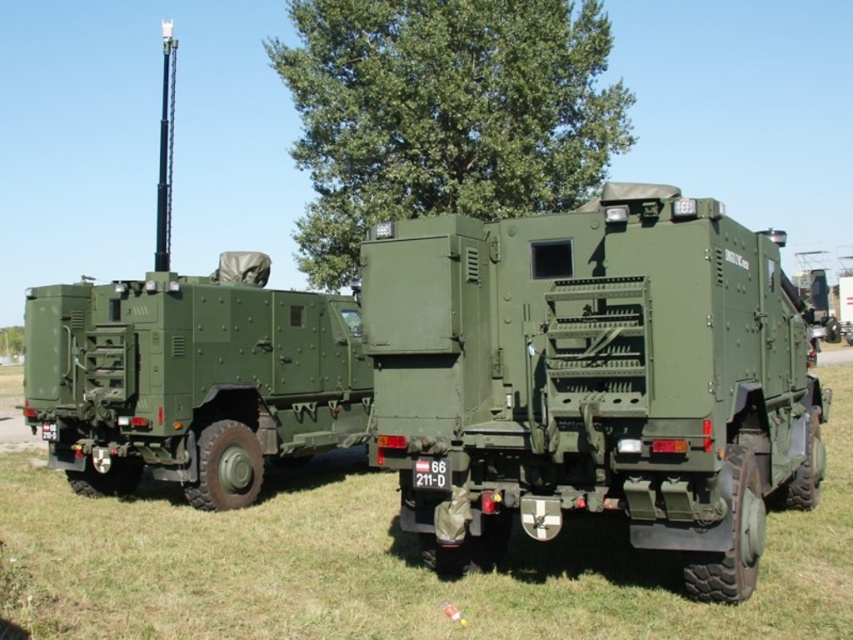
Which of these two, green matte grass at lower center or matte green military vehicle at left, stands taller?

matte green military vehicle at left

Can you confirm if green matte grass at lower center is bigger than matte green military vehicle at left?

No, green matte grass at lower center is not bigger than matte green military vehicle at left.

Locate an element on the screen. This screenshot has height=640, width=853. green matte grass at lower center is located at coordinates (386, 564).

Where is `green matte grass at lower center`? This screenshot has width=853, height=640. green matte grass at lower center is located at coordinates click(x=386, y=564).

Between point (509, 115) and point (163, 70), which one is positioned in front?

Point (509, 115) is more forward.

The width and height of the screenshot is (853, 640). What do you see at coordinates (444, 113) in the screenshot?
I see `green leafy tree at upper center` at bounding box center [444, 113].

Where is `green leafy tree at upper center`? The height and width of the screenshot is (640, 853). green leafy tree at upper center is located at coordinates (444, 113).

Does point (537, 365) come farther from viewer compared to point (308, 209)?

No, (537, 365) is in front of (308, 209).

Who is more forward, (479, 356) or (440, 170)?

Point (479, 356) is in front.

Locate an element on the screen. matte green truck at center is located at coordinates (593, 378).